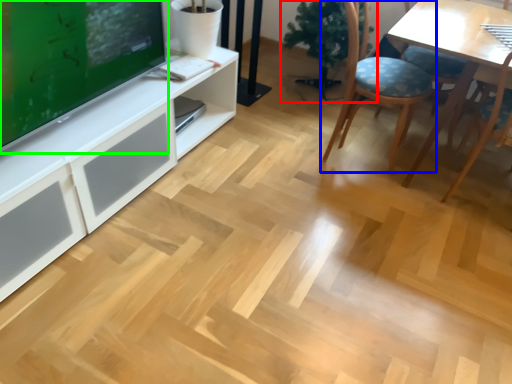
Question: Based on their relative distances, which object is farther from houseplant (highlighted by a red box)? Choose from chair (highlighted by a blue box) and television (highlighted by a green box).

Choices:
 (A) chair
 (B) television

Answer: (B)